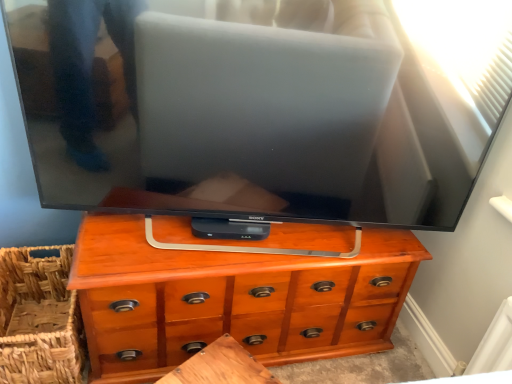
Image resolution: width=512 pixels, height=384 pixels. I want to click on woven brown basket at lower left, so click(39, 317).

Find the location of a particular element. wooden chest of drawers at center is located at coordinates (231, 297).

Considering the points (52, 317) and (243, 346), which point is in front, point (52, 317) or point (243, 346)?

The point (243, 346) is closer to the camera.

How many degrees apart are the facing directions of woven brown basket at lower left and wooden chest of drawers at center?

0.000649 degrees separate the facing orientations of woven brown basket at lower left and wooden chest of drawers at center.

Is woven brown basket at lower left in contact with wooden chest of drawers at center?

No, woven brown basket at lower left is not with wooden chest of drawers at center.

Is woven brown basket at lower left at the left side of wooden chest of drawers at center?

Yes, woven brown basket at lower left is to the left of wooden chest of drawers at center.

Considering the positions of objects wooden chest of drawers at center and wooden table at center in the image provided, who is in front, wooden chest of drawers at center or wooden table at center?

wooden table at center is in front.

Consider the image. In terms of height, does wooden chest of drawers at center look taller or shorter compared to wooden table at center?

In the image, wooden chest of drawers at center appears to be taller than wooden table at center.

Where is `chest of drawers above the wooden table at center (from a real-world perspective)`? This screenshot has width=512, height=384. chest of drawers above the wooden table at center (from a real-world perspective) is located at coordinates (231, 297).

Considering the sizes of objects wooden chest of drawers at center and wooden table at center in the image provided, who is smaller, wooden chest of drawers at center or wooden table at center?

wooden table at center is smaller.

Considering the relative sizes of wooden chest of drawers at center and woven brown basket at lower left in the image provided, is wooden chest of drawers at center wider than woven brown basket at lower left?

In fact, wooden chest of drawers at center might be narrower than woven brown basket at lower left.

Is wooden chest of drawers at center oriented towards woven brown basket at lower left?

No, wooden chest of drawers at center is not oriented towards woven brown basket at lower left.

Is wooden chest of drawers at center inside or outside of woven brown basket at lower left?

wooden chest of drawers at center is outside woven brown basket at lower left.

Is wooden chest of drawers at center positioned far away from woven brown basket at lower left?

No, wooden chest of drawers at center is not far from woven brown basket at lower left.

From the picture: From a real-world perspective, is woven brown basket at lower left beneath wooden table at center?

Incorrect, from a real-world perspective, woven brown basket at lower left is higher than wooden table at center.

Is woven brown basket at lower left spatially inside wooden table at center, or outside of it?

The correct answer is: outside.

Between woven brown basket at lower left and wooden table at center, which one has smaller size?

wooden table at center.

Locate an element on the screen. This screenshot has height=384, width=512. table below the woven brown basket at lower left (from a real-world perspective) is located at coordinates (220, 366).

In order to click on table to the left of wooden chest of drawers at center in this screenshot , I will do `click(220, 366)`.

Which is behind, wooden table at center or wooden chest of drawers at center?

Positioned behind is wooden chest of drawers at center.

Which is more to the left, wooden table at center or wooden chest of drawers at center?

wooden table at center.

From a real-world perspective, is wooden table at center located beneath woven brown basket at lower left?

Yes.

Can you confirm if wooden table at center is positioned to the right of woven brown basket at lower left?

Yes.

This screenshot has height=384, width=512. In the image, there is a woven brown basket at lower left. In order to click on the chest of drawers above it (from the image's perspective) in this screenshot , I will do `click(231, 297)`.

Image resolution: width=512 pixels, height=384 pixels. What are the coordinates of `table below the wooden chest of drawers at center (from a real-world perspective)` in the screenshot? It's located at (220, 366).

From the picture: Based on their spatial positions, is wooden chest of drawers at center or woven brown basket at lower left closer to wooden table at center?

wooden chest of drawers at center is closer to wooden table at center.

Based on their spatial positions, is wooden table at center or wooden chest of drawers at center further from woven brown basket at lower left?

wooden table at center is further to woven brown basket at lower left.

Which object lies further to the anchor point wooden chest of drawers at center, woven brown basket at lower left or wooden table at center?

woven brown basket at lower left.

Considering their positions, is woven brown basket at lower left positioned closer to wooden table at center than wooden chest of drawers at center?

The object closer to wooden table at center is wooden chest of drawers at center.

From the image, which object appears to be farther from woven brown basket at lower left, wooden chest of drawers at center or wooden table at center?

The object further to woven brown basket at lower left is wooden table at center.

Which object lies further to the anchor point wooden chest of drawers at center, wooden table at center or woven brown basket at lower left?

woven brown basket at lower left is positioned further to the anchor wooden chest of drawers at center.

Image resolution: width=512 pixels, height=384 pixels. Find the location of `table located between woven brown basket at lower left and wooden chest of drawers at center in the left-right direction`. table located between woven brown basket at lower left and wooden chest of drawers at center in the left-right direction is located at coordinates (220, 366).